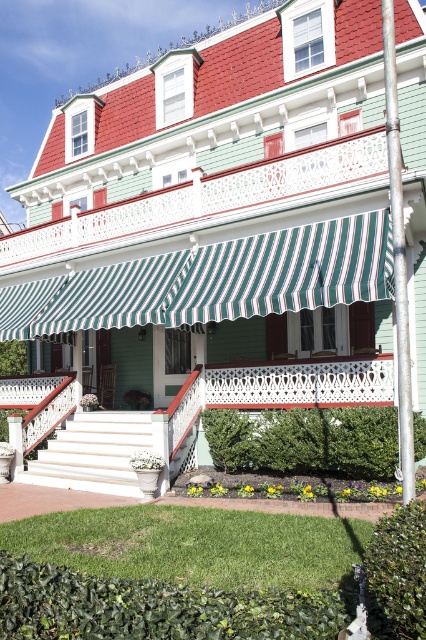
You are standing in front of the house and want to sit on the white painted wood porch at center. To reach it, you need to walk past the green striped awning at center. Is the awning in your way?

The green striped awning at center is closer to the viewer than the white painted wood porch at center, so yes, the awning is in your way when approaching the porch.

You are planning to install a new lighting fixture on the porch. Given that the green striped awning at center is larger than the white painted wood porch at center, where should you place the light to ensure it illuminates the entire porch area without being blocked by the awning?

The green striped awning at center is larger than the white painted wood porch at center, so placing the light fixture near the edge of the white painted wood porch at center closest to the house would ensure it is positioned below the awning and can illuminate the entire porch area without obstruction.